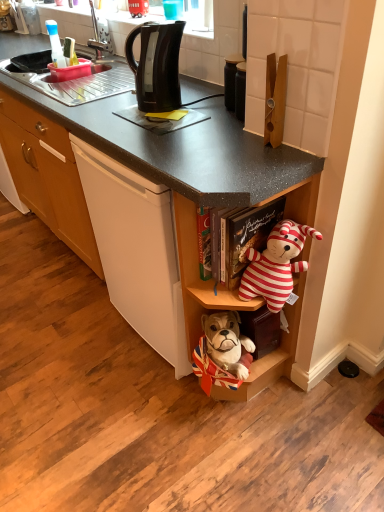
This screenshot has height=512, width=384. What are the coordinates of `vacant space underneath striped fabric teddy bear at center-right (from a real-world perspective)` in the screenshot? It's located at (283, 399).